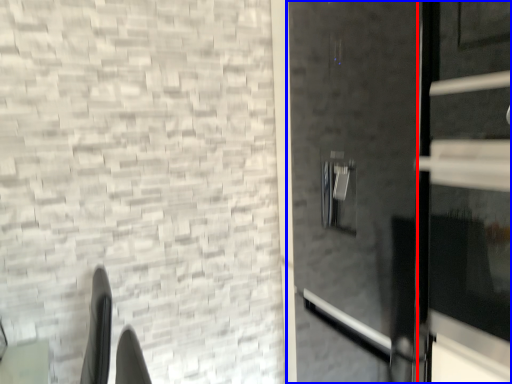
Question: Which object is closer to the camera taking this photo, door (highlighted by a red box) or door (highlighted by a blue box)?

Choices:
 (A) door
 (B) door

Answer: (A)